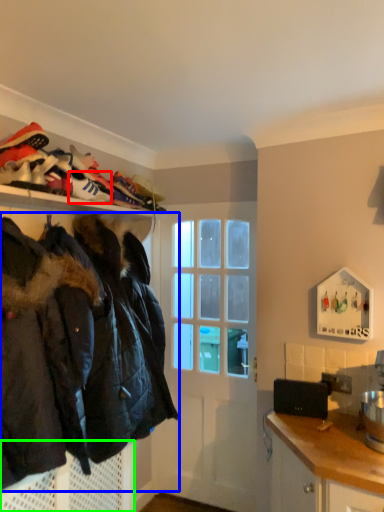
Question: Based on their relative distances, which object is farther from shoe (highlighted by a red box)? Choose from jacket (highlighted by a blue box) and cabinetry (highlighted by a green box).

Choices:
 (A) jacket
 (B) cabinetry

Answer: (B)